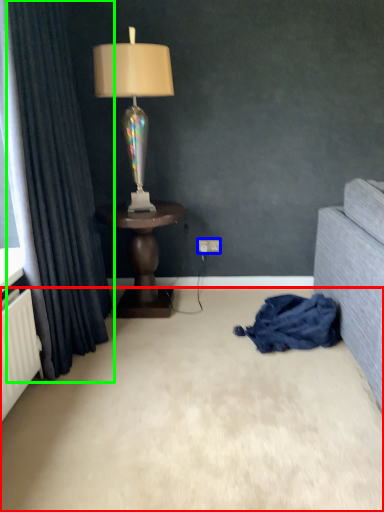
Question: Based on their relative distances, which object is nearer to plain (highlighted by a red box)? Choose from electric outlet (highlighted by a blue box) and curtain (highlighted by a green box).

Choices:
 (A) electric outlet
 (B) curtain

Answer: (B)